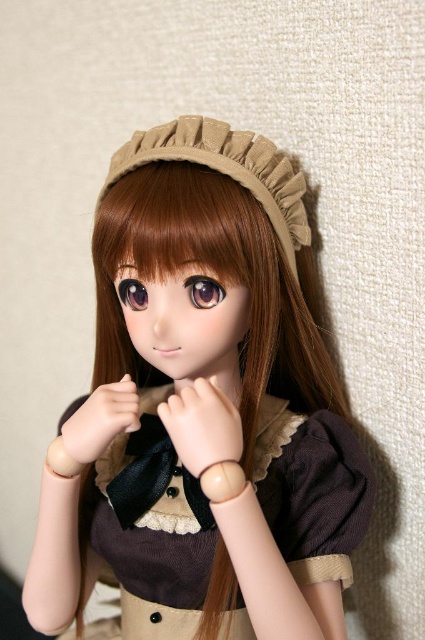
The brown corduroy dress at center is placed on a hanger. You are a tailor who needs to reach the dress to adjust the hem. Your arm can extend 28 inches. Can you reach the dress?

The brown corduroy dress at center is 30.95 inches away, so you cannot reach it with an arm extension of 28 inches. You need to move closer or use a tool.

You are an artist trying to draw the doll from the image. You need to decide the order to draw the parts so that the one closer to the viewer is drawn last. Which should you draw first, the matte brown dress at center or the matte brown hand at center?

The matte brown hand at center should be drawn first because it is closer to the viewer than the matte brown dress at center, so the dress is drawn last.

Looking at the doll in the scene, which object is bigger between the brown corduroy dress at center and the glossy purple eye at center?

The brown corduroy dress at center is larger in size than the glossy purple eye at center.